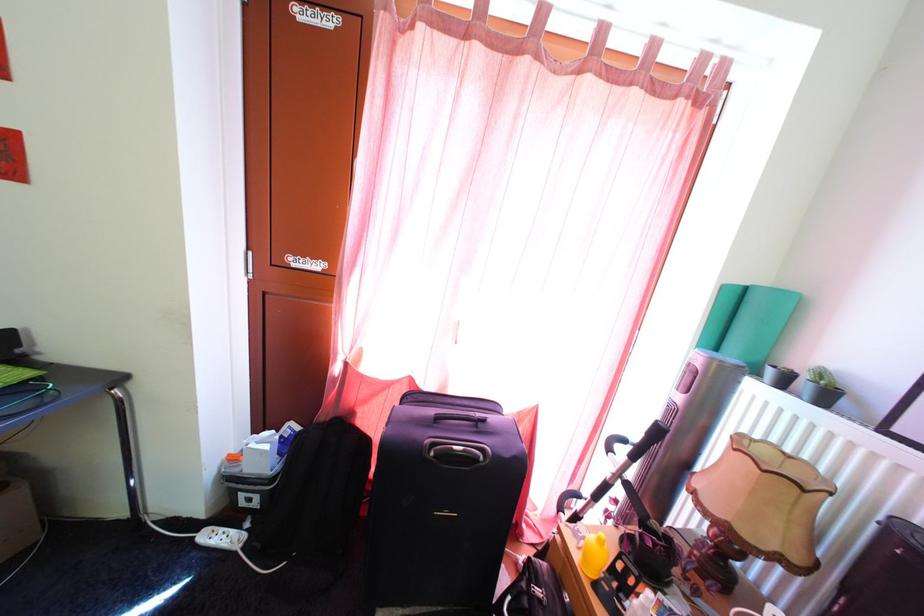
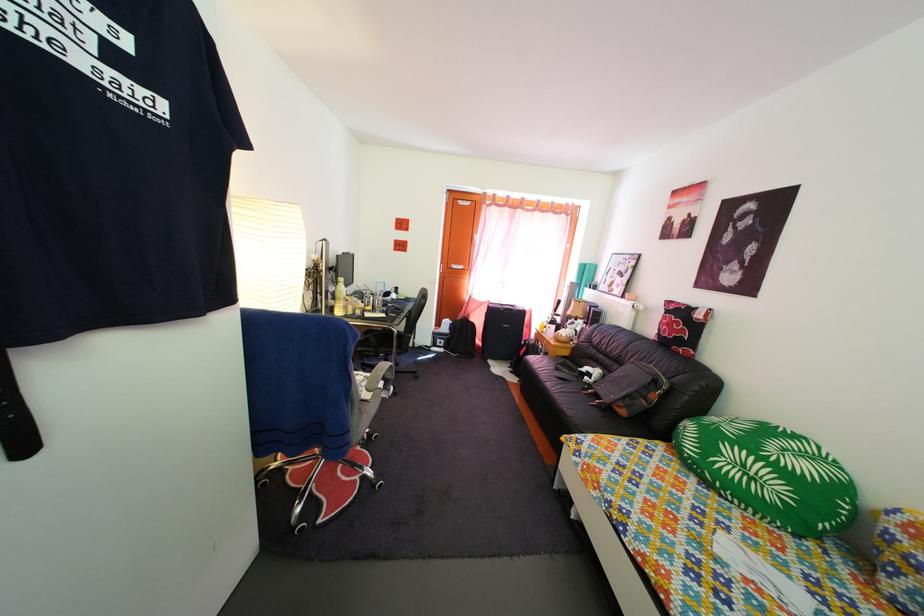
Question: Which direction would the cameraman need to move to produce the second image? Reply with the corresponding letter.

Choices:
 (A) Left
 (B) Right
 (C) Forward
 (D) Backward

Answer: (D)